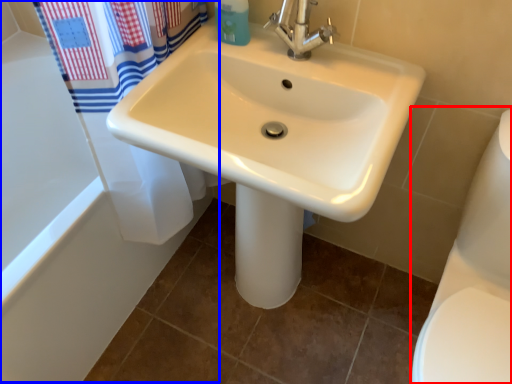
Question: Which object appears closest to the camera in this image, toilet bowl (highlighted by a red box) or bath (highlighted by a blue box)?

Choices:
 (A) toilet bowl
 (B) bath

Answer: (A)